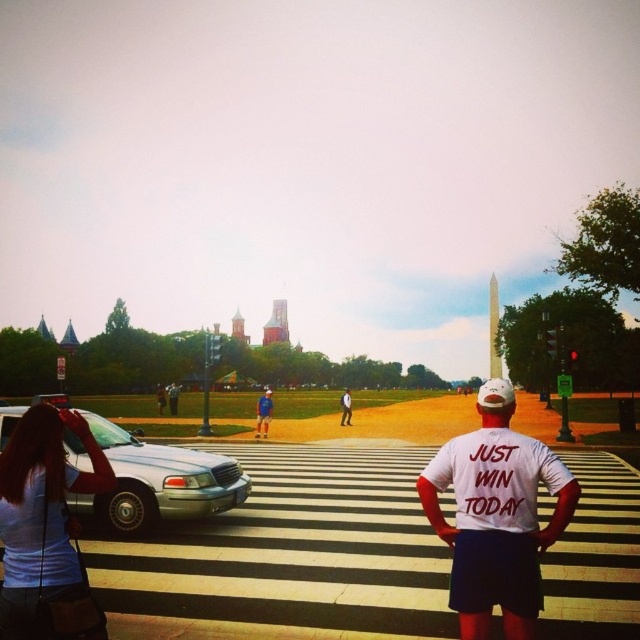
From the picture: You are standing at point (120, 452) and want to take a photo of the Washington Monument. The camera you have can focus up to 20 meters. Will you be able to capture the monument clearly?

The distance between point (120, 452) and the camera is 18.62 meters, which is within the camera focus range of 20 meters. Therefore, you can capture the Washington Monument clearly.

You are a photographer planning to take a wide shot of the Washington Monument in the background. You need to ensure that both the silver metallic sedan at lower left and the blue denim shorts at center are fully visible in your frame. Based on their positions, which object is more likely to be in the way of the monument view?

The silver metallic sedan at lower left is wider than the blue denim shorts at center, so it is more likely to obstruct the view of the Washington Monument in the background.